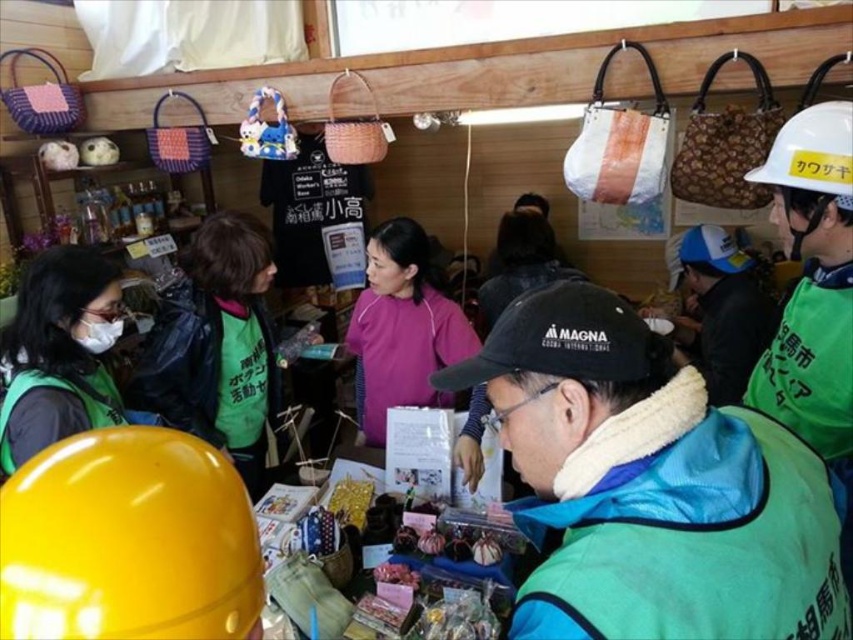
Question: Does green fabric vest at left appear on the left side of pink matte shirt at center?

Choices:
 (A) yes
 (B) no

Answer: (A)

Question: Does pink matte shirt at center have a greater width compared to white matte mask at left?

Choices:
 (A) no
 (B) yes

Answer: (B)

Question: Which object is farther from the camera taking this photo?

Choices:
 (A) pink matte shirt at center
 (B) white matte mask at left

Answer: (A)

Question: Which of the following is the closest to the observer?

Choices:
 (A) green fabric vest at left
 (B) white matte mask at left

Answer: (B)

Question: Is green fabric vest at left wider than pink matte shirt at center?

Choices:
 (A) no
 (B) yes

Answer: (A)

Question: Among these objects, which one is nearest to the camera?

Choices:
 (A) pink matte shirt at center
 (B) white matte mask at left
 (C) green fabric vest at left

Answer: (B)